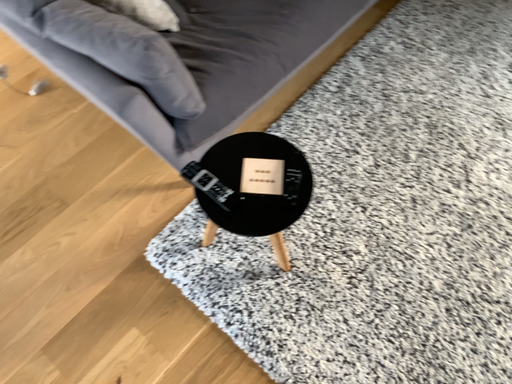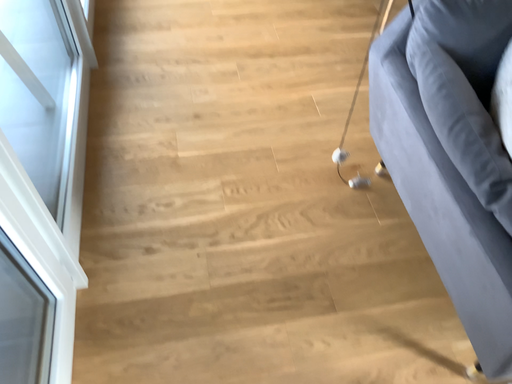
Question: Which way did the camera rotate in the video?

Choices:
 (A) rotated left
 (B) rotated right

Answer: (A)